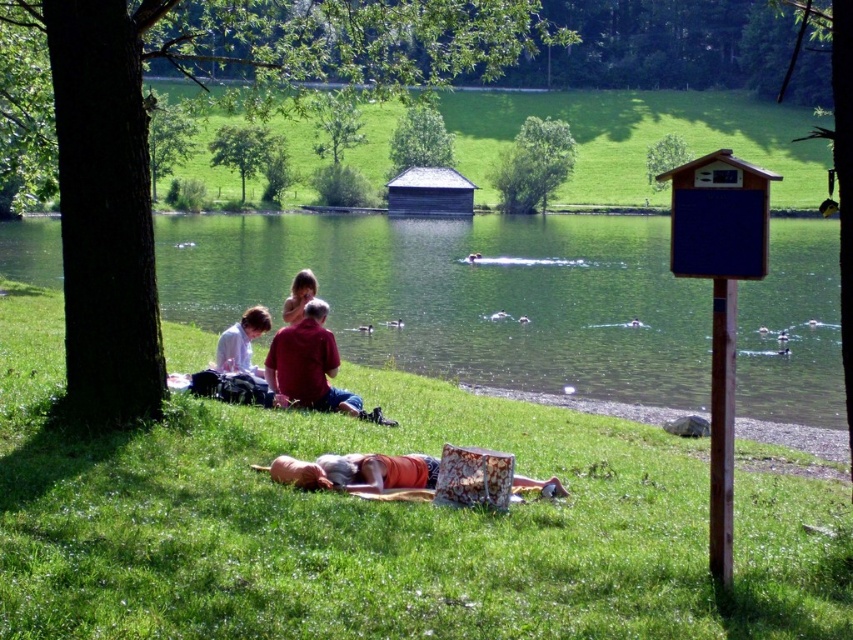
Which of these two, orange cotton shirt at lower center or white paper at lower left, stands taller?

With more height is white paper at lower left.

Can you confirm if orange cotton shirt at lower center is positioned above white paper at lower left?

No.

Is point (357, 461) closer to camera compared to point (238, 364)?

Yes, it is in front of point (238, 364).

The image size is (853, 640). Identify the location of orange cotton shirt at lower center. (358, 472).

Between point (183, 301) and point (251, 317), which one is positioned behind?

The point (183, 301) is more distant.

Is green smooth water at center bigger than white paper at lower left?

Yes, green smooth water at center is bigger than white paper at lower left.

Is point (808, 289) positioned after point (251, 339)?

Yes.

Where is `green smooth water at center`? The width and height of the screenshot is (853, 640). green smooth water at center is located at coordinates (465, 296).

Between green smooth water at center and red shirt at center, which one appears on the right side from the viewer's perspective?

red shirt at center

Consider the image. Is green smooth water at center to the right of red shirt at center from the viewer's perspective?

Incorrect, green smooth water at center is not on the right side of red shirt at center.

Where is `green smooth water at center`? The height and width of the screenshot is (640, 853). green smooth water at center is located at coordinates (465, 296).

Where is `green smooth water at center`? green smooth water at center is located at coordinates (465, 296).